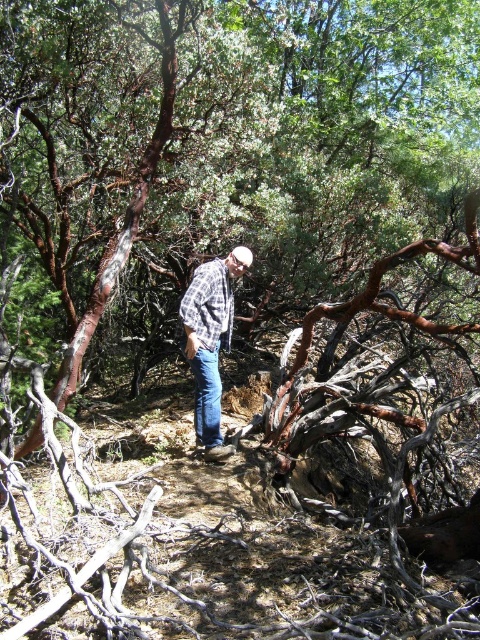
Question: Does brown rough bark tree at center have a greater width compared to plaid shirt at center?

Choices:
 (A) no
 (B) yes

Answer: (B)

Question: Which of the following is the closest to the observer?

Choices:
 (A) (142, 120)
 (B) (214, 314)

Answer: (B)

Question: Which point is closer to the camera?

Choices:
 (A) brown rough bark tree at center
 (B) plaid shirt at center

Answer: (A)

Question: Is brown rough bark tree at center above plaid shirt at center?

Choices:
 (A) yes
 (B) no

Answer: (A)

Question: Can you confirm if brown rough bark tree at center is smaller than plaid shirt at center?

Choices:
 (A) yes
 (B) no

Answer: (B)